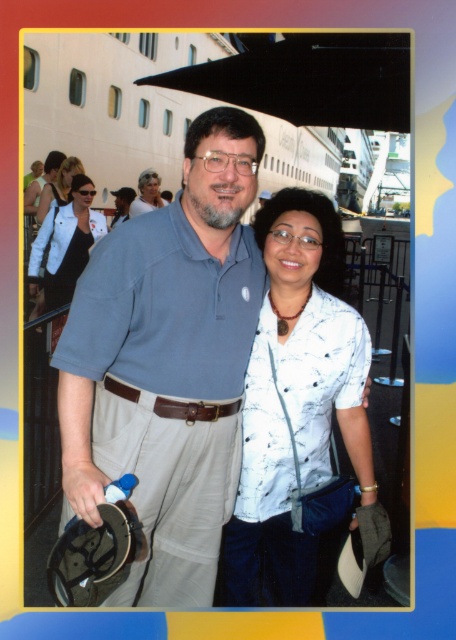
From the picture: You are a photographer taking a picture of the scene. You need to ensure that the white printed shirt at center and the blonde hair at upper left are both in focus. Based on their positions, which object should you adjust your camera focus on first to ensure both are sharp?

The white printed shirt at center is to the right of blonde hair at upper left. To ensure both are in focus, adjust the camera focus starting from the blonde hair at upper left and then the white printed shirt at center since they are positioned side by side horizontally.

You are a photographer standing at the scene described. You want to take a photo that includes both the white printed shirt at center and the white smooth cruise ship at upper center. Given the distance between them, will you need to zoom in or zoom out to ensure both are fully visible in the frame?

The white printed shirt at center and white smooth cruise ship at upper center are 22.48 feet apart. To include both in the frame, you would need to zoom out to capture the distance between them.